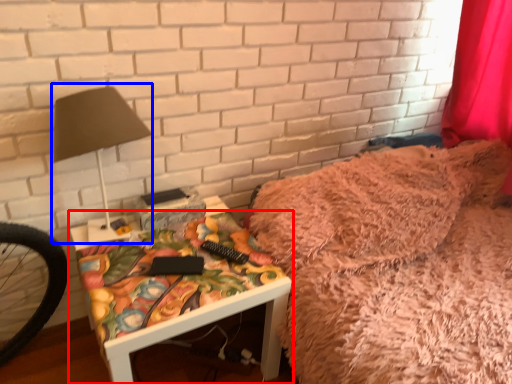
Question: Which point is further to the camera, furniture (highlighted by a red box) or table lamp (highlighted by a blue box)?

Choices:
 (A) furniture
 (B) table lamp

Answer: (A)